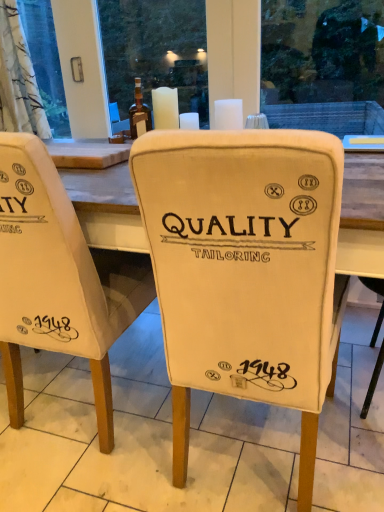
The height and width of the screenshot is (512, 384). What do you see at coordinates (139, 111) in the screenshot? I see `translucent glass bottle at center` at bounding box center [139, 111].

Locate an element on the screen. This screenshot has width=384, height=512. white fabric chair at center, placed as the first chair when sorted from right to left is located at coordinates (245, 270).

This screenshot has height=512, width=384. Describe the element at coordinates (245, 270) in the screenshot. I see `white fabric chair at center, placed as the 2th chair when sorted from left to right` at that location.

Measure the distance between white fabric chair at center and camera.

1.10 meters.

Find the location of a particular element. white fabric chair at center is located at coordinates (140, 439).

This screenshot has height=512, width=384. I want to click on translucent glass bottle at center, so click(x=139, y=111).

What's the angular difference between white matte candle at upper center, the 2th candle positioned from the left, and white fabric chair at center, placed as the first chair when sorted from right to left,'s facing directions?

The angular difference between white matte candle at upper center, the 2th candle positioned from the left, and white fabric chair at center, placed as the first chair when sorted from right to left, is 180 degrees.

Looking at this image, is white matte candle at upper center, the 2th candle positioned from the left, taller than white fabric chair at center, placed as the 2th chair when sorted from left to right?

In fact, white matte candle at upper center, the 2th candle positioned from the left, may be shorter than white fabric chair at center, placed as the 2th chair when sorted from left to right.

Considering the points (223, 105) and (266, 395), which point is behind, point (223, 105) or point (266, 395)?

Point (223, 105)

Choose the correct answer: Is white matte candle at upper center, the 2th candle positioned from the left, inside white fabric chair at center, placed as the first chair when sorted from right to left, or outside it?

white matte candle at upper center, the 2th candle positioned from the left, cannot be found inside white fabric chair at center, placed as the first chair when sorted from right to left.

Relative to translucent glass bottle at center, is white fabric chair at center in front or behind?

In the image, white fabric chair at center appears in front of translucent glass bottle at center.

In the scene shown: From a real-world perspective, is white fabric chair at center on translucent glass bottle at center?

No, from a real-world perspective, white fabric chair at center is not over translucent glass bottle at center

From the image's perspective, is white fabric chair at center above or below translucent glass bottle at center?

white fabric chair at center is below translucent glass bottle at center.

How much distance is there between white fabric chair at center and translucent glass bottle at center?

They are 1.11 meters apart.

Does white fabric chair at center, which appears as the 2th chair when viewed from the right, have a smaller size compared to white fabric chair at center, placed as the 2th chair when sorted from left to right?

Correct, white fabric chair at center, which appears as the 2th chair when viewed from the right, occupies less space than white fabric chair at center, placed as the 2th chair when sorted from left to right.

From a real-world perspective, who is located lower, white fabric chair at center, the 1th chair positioned from the left, or white fabric chair at center, placed as the first chair when sorted from right to left?

white fabric chair at center, the 1th chair positioned from the left, is physically lower.

Could white fabric chair at center, placed as the 2th chair when sorted from left to right, be considered to be inside white fabric chair at center, the 1th chair positioned from the left?

No.

From the image's perspective, which is below, white fabric chair at center or white fabric chair at center, the 1th chair positioned from the left?

A: white fabric chair at center.

Is white fabric chair at center, the 1th chair positioned from the left, a part of white fabric chair at center?

No, white fabric chair at center, the 1th chair positioned from the left, is not a part of white fabric chair at center.

Is white fabric chair at center in front of white fabric chair at center, the 1th chair positioned from the left?

No, white fabric chair at center is behind white fabric chair at center, the 1th chair positioned from the left.

Is point (248, 443) farther from viewer compared to point (32, 212)?

Yes, point (248, 443) is farther from viewer.

Which object is closer to the camera taking this photo, translucent glass bottle at center or white fabric chair at center, placed as the first chair when sorted from right to left?

white fabric chair at center, placed as the first chair when sorted from right to left.

Which of these two, translucent glass bottle at center or white fabric chair at center, placed as the first chair when sorted from right to left, is wider?

white fabric chair at center, placed as the first chair when sorted from right to left.

Is translucent glass bottle at center at the right side of white fabric chair at center, placed as the first chair when sorted from right to left?

Incorrect, translucent glass bottle at center is not on the right side of white fabric chair at center, placed as the first chair when sorted from right to left.

Is white fabric chair at center far away from white matte candle at upper center, arranged as the first candle when viewed from the right?

Absolutely, white fabric chair at center is distant from white matte candle at upper center, arranged as the first candle when viewed from the right.

Which object is wider, white fabric chair at center or white matte candle at upper center, the 2th candle positioned from the left?

With larger width is white fabric chair at center.

Is white fabric chair at center in front of or behind white matte candle at upper center, the 2th candle positioned from the left, in the image?

white fabric chair at center is in front of white matte candle at upper center, the 2th candle positioned from the left.

From the picture: Is white fabric chair at center taller than white matte candle at upper center, arranged as the first candle when viewed from the right?

No.

Does translucent glass bottle at center have a larger size compared to white fabric chair at center?

No, translucent glass bottle at center is not bigger than white fabric chair at center.

From a real-world perspective, is translucent glass bottle at center below white fabric chair at center?

No, from a real-world perspective, translucent glass bottle at center is not beneath white fabric chair at center.

Is translucent glass bottle at center oriented away from white fabric chair at center?

No.

Is point (141, 99) closer or farther from the camera than point (59, 369)?

Clearly, point (141, 99) is closer to the camera than point (59, 369).

From the white fabric chair at center, placed as the first chair when sorted from right to left, count 1st candles backward and point to it. Please provide its 2D coordinates.

[(228, 114)]

Image resolution: width=384 pixels, height=512 pixels. What are the coordinates of `tile in front of the translucent glass bottle at center` in the screenshot? It's located at (140, 439).

Based on their spatial positions, is white fabric chair at center, which appears as the 2th chair when viewed from the right, or white matte candle at upper center, arranged as the first candle when viewed from the right, further from white wax candle at upper center, the first candle from the left?

white fabric chair at center, which appears as the 2th chair when viewed from the right, is further to white wax candle at upper center, the first candle from the left.

Looking at this image, considering their positions, is white fabric chair at center, which appears as the 2th chair when viewed from the right, positioned closer to white matte candle at upper center, arranged as the first candle when viewed from the right, than white wax candle at upper center, arranged as the 2th candle when viewed from the right?

The object closer to white matte candle at upper center, arranged as the first candle when viewed from the right, is white wax candle at upper center, arranged as the 2th candle when viewed from the right.

From the image, which object appears to be farther from white fabric chair at center, the 1th chair positioned from the left, white fabric chair at center or white wax candle at upper center, arranged as the 2th candle when viewed from the right?

white wax candle at upper center, arranged as the 2th candle when viewed from the right, lies further to white fabric chair at center, the 1th chair positioned from the left, than the other object.

Estimate the real-world distances between objects in this image. Which object is further from translucent glass bottle at center, white fabric chair at center, placed as the 2th chair when sorted from left to right, or white fabric chair at center?

Among the two, white fabric chair at center is located further to translucent glass bottle at center.

Looking at the image, which one is located closer to white fabric chair at center, placed as the first chair when sorted from right to left, white fabric chair at center, the 1th chair positioned from the left, or white wax candle at upper center, the first candle from the left?

The object closer to white fabric chair at center, placed as the first chair when sorted from right to left, is white fabric chair at center, the 1th chair positioned from the left.

From the image, which object appears to be nearer to white fabric chair at center, placed as the first chair when sorted from right to left, white fabric chair at center or white wax candle at upper center, arranged as the 2th candle when viewed from the right?

white fabric chair at center is positioned closer to the anchor white fabric chair at center, placed as the first chair when sorted from right to left.

When comparing their distances from white fabric chair at center, the 1th chair positioned from the left, does white fabric chair at center, placed as the 2th chair when sorted from left to right, or white fabric chair at center seem further?

white fabric chair at center lies further to white fabric chair at center, the 1th chair positioned from the left, than the other object.

When comparing their distances from white fabric chair at center, placed as the first chair when sorted from right to left, does white wax candle at upper center, the first candle from the left, or translucent glass bottle at center seem closer?

Among the two, white wax candle at upper center, the first candle from the left, is located nearer to white fabric chair at center, placed as the first chair when sorted from right to left.

The image size is (384, 512). In order to click on chair between white fabric chair at center, placed as the 2th chair when sorted from left to right, and white wax candle at upper center, arranged as the 2th candle when viewed from the right, from front to back in this screenshot , I will do `click(59, 279)`.

You are a GUI agent. You are given a task and a screenshot of the screen. Output one action in this format:
    pyautogui.click(x=<x>, y=<y>)
    Task: Click on the candle between white wax candle at upper center, arranged as the 2th candle when viewed from the right, and white fabric chair at center, in the vertical direction
    
    Given the screenshot: What is the action you would take?
    pyautogui.click(x=228, y=114)

Find the location of a particular element. This screenshot has height=512, width=384. chair between white fabric chair at center, placed as the first chair when sorted from right to left, and white matte candle at upper center, arranged as the first candle when viewed from the right, from front to back is located at coordinates (59, 279).

The image size is (384, 512). I want to click on candle between translucent glass bottle at center and white matte candle at upper center, the 2th candle positioned from the left, so click(x=165, y=108).